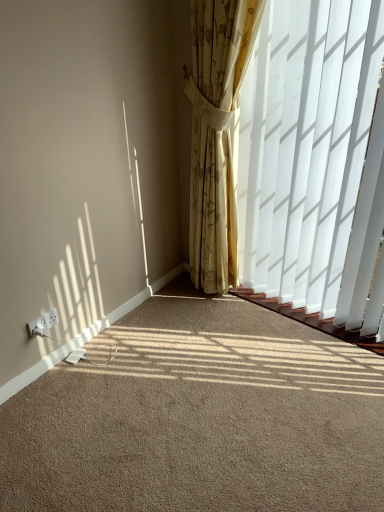
Identify the location of beige carpet at lower left. The height and width of the screenshot is (512, 384). (200, 417).

Is white plastic electric outlet at lower left further to camera compared to yellow floral fabric curtain at center?

Yes, the depth of white plastic electric outlet at lower left is greater than that of yellow floral fabric curtain at center.

Is white plastic electric outlet at lower left oriented towards yellow floral fabric curtain at center?

No, white plastic electric outlet at lower left is not turned towards yellow floral fabric curtain at center.

From the image's perspective, is white plastic electric outlet at lower left located above yellow floral fabric curtain at center?

No, from the image's perspective, white plastic electric outlet at lower left is not on top of yellow floral fabric curtain at center.

Considering the positions of points (51, 327) and (230, 160), is point (51, 327) closer to camera compared to point (230, 160)?

Yes, point (51, 327) is closer to viewer.

Considering the points (222, 176) and (283, 330), which point is in front, point (222, 176) or point (283, 330)?

The point (222, 176) is closer.

From a real-world perspective, who is located lower, yellow floral fabric curtain at center or beige carpet at lower left?

From a 3D spatial view, beige carpet at lower left is below.

Considering the sizes of objects yellow floral fabric curtain at center and beige carpet at lower left in the image provided, who is shorter, yellow floral fabric curtain at center or beige carpet at lower left?

beige carpet at lower left is shorter.

Which object is more forward, yellow floral fabric curtain at center or beige carpet at lower left?

Positioned in front is beige carpet at lower left.

From a real-world perspective, is white plastic electric outlet at lower left beneath beige carpet at lower left?

No, from a real-world perspective, white plastic electric outlet at lower left is not beneath beige carpet at lower left.

Who is taller, white plastic electric outlet at lower left or beige carpet at lower left?

white plastic electric outlet at lower left.

How different are the orientations of white plastic electric outlet at lower left and beige carpet at lower left in degrees?

There is a 91.1-degree angle between the facing directions of white plastic electric outlet at lower left and beige carpet at lower left.

Does point (37, 323) come in front of point (274, 486)?

No, (37, 323) is further to viewer.

Is yellow floral fabric curtain at center directly adjacent to white plastic electric outlet at lower left?

No, yellow floral fabric curtain at center is not beside white plastic electric outlet at lower left.

Considering the positions of point (213, 128) and point (53, 313), is point (213, 128) closer or farther from the camera than point (53, 313)?

Clearly, point (213, 128) is more distant from the camera than point (53, 313).

How much distance is there between yellow floral fabric curtain at center and white plastic electric outlet at lower left?

A distance of 3.60 feet exists between yellow floral fabric curtain at center and white plastic electric outlet at lower left.

Is beige carpet at lower left to the right of white plastic electric outlet at lower left from the viewer's perspective?

Indeed, beige carpet at lower left is positioned on the right side of white plastic electric outlet at lower left.

Is beige carpet at lower left oriented away from white plastic electric outlet at lower left?

No.

Based on their sizes in the image, would you say beige carpet at lower left is bigger or smaller than yellow floral fabric curtain at center?

Clearly, beige carpet at lower left is smaller in size than yellow floral fabric curtain at center.

Which object is positioned more to the left, beige carpet at lower left or yellow floral fabric curtain at center?

beige carpet at lower left is more to the left.

Are beige carpet at lower left and yellow floral fabric curtain at center located far from each other?

No.

Is beige carpet at lower left turned away from yellow floral fabric curtain at center?

That's not correct — beige carpet at lower left is not looking away from yellow floral fabric curtain at center.

This screenshot has height=512, width=384. In order to click on curtain above the white plastic electric outlet at lower left (from a real-world perspective) in this screenshot , I will do `click(216, 133)`.

Where is `curtain above the beige carpet at lower left (from the image's perspective)`? curtain above the beige carpet at lower left (from the image's perspective) is located at coordinates (216, 133).

Which object lies nearer to the anchor point yellow floral fabric curtain at center, beige carpet at lower left or white plastic electric outlet at lower left?

Among the two, beige carpet at lower left is located nearer to yellow floral fabric curtain at center.

When comparing their distances from beige carpet at lower left, does yellow floral fabric curtain at center or white plastic electric outlet at lower left seem further?

yellow floral fabric curtain at center.

From the image, which object appears to be farther from white plastic electric outlet at lower left, beige carpet at lower left or yellow floral fabric curtain at center?

yellow floral fabric curtain at center is positioned further to the anchor white plastic electric outlet at lower left.

Based on their spatial positions, is white plastic electric outlet at lower left or yellow floral fabric curtain at center further from beige carpet at lower left?

yellow floral fabric curtain at center.

Estimate the real-world distances between objects in this image. Which object is further from white plastic electric outlet at lower left, yellow floral fabric curtain at center or beige carpet at lower left?

yellow floral fabric curtain at center lies further to white plastic electric outlet at lower left than the other object.

Which object lies nearer to the anchor point yellow floral fabric curtain at center, white plastic electric outlet at lower left or beige carpet at lower left?

beige carpet at lower left.

Where is `electric outlet between yellow floral fabric curtain at center and beige carpet at lower left from top to bottom`? This screenshot has width=384, height=512. electric outlet between yellow floral fabric curtain at center and beige carpet at lower left from top to bottom is located at coordinates (42, 324).